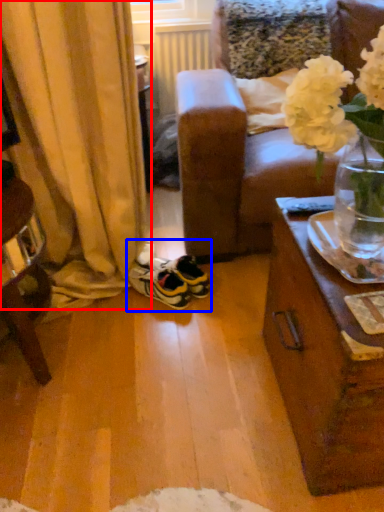
Question: Which object is further to the camera taking this photo, curtain (highlighted by a red box) or footwear (highlighted by a blue box)?

Choices:
 (A) curtain
 (B) footwear

Answer: (B)